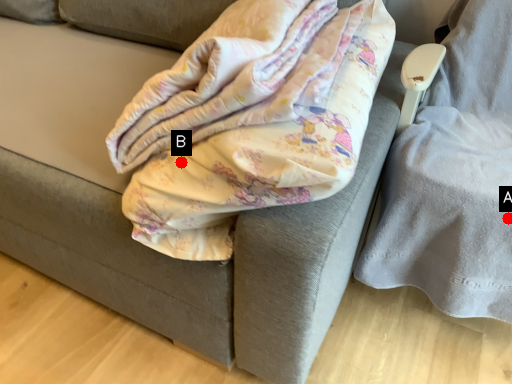
Question: Two points are circled on the image, labeled by A and B beside each circle. Which of the following is the farthest from the observer?

Choices:
 (A) A is further
 (B) B is further

Answer: (A)